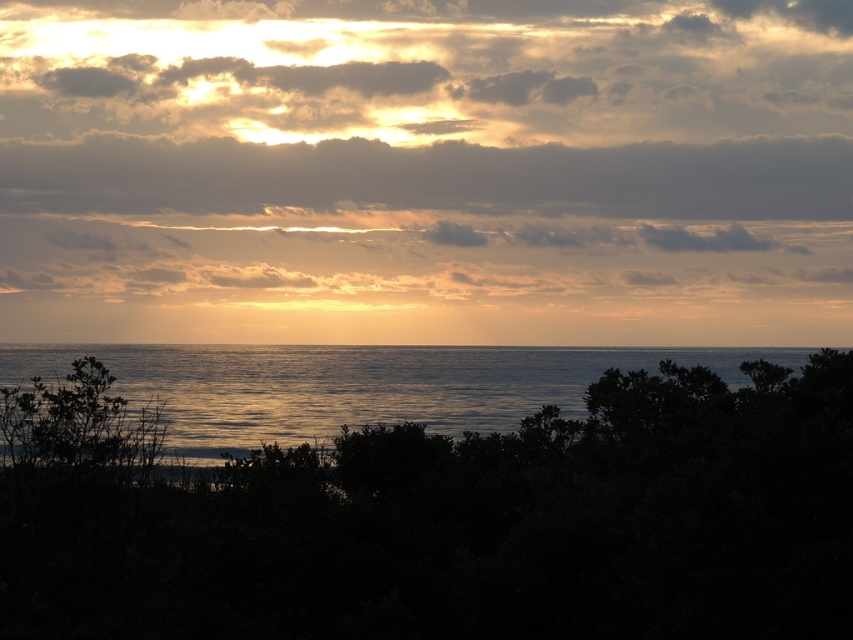
Looking at this image, you are standing on the beach and see the cloudy sky at upper center and the green leafy tree at center. From your perspective, which object is positioned to the right side?

The cloudy sky at upper center is to the right of the green leafy tree at center.

You are an astronomer observing the sunset and notice the cloudy sky at upper center and the dark gray cloud at upper center in the image. Which of these two has a greater height?

The cloudy sky at upper center is much taller than the dark gray cloud at upper center, so the cloudy sky at upper center has a greater height.